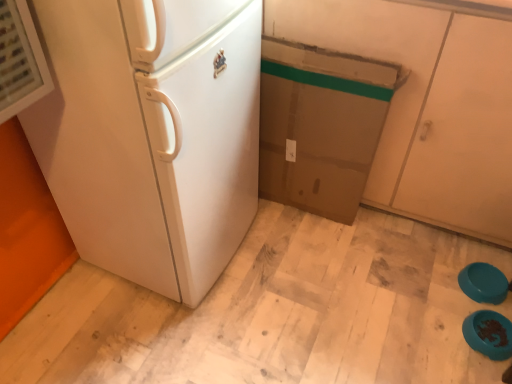
Question: Is teal plastic bowls at lower right, the 2th appliance viewed from the front, taller or shorter than teal glossy bowls at lower right, the 2th appliance in the back-to-front sequence?

Choices:
 (A) short
 (B) tall

Answer: (A)

Question: From a real-world perspective, relative to teal glossy bowls at lower right, marked as the 1th appliance in a front-to-back arrangement, is teal plastic bowls at lower right, which appears as the 1th appliance when viewed from the back, vertically above or below?

Choices:
 (A) above
 (B) below

Answer: (A)

Question: Which object is positioned closest to the white matte refrigerator at left?

Choices:
 (A) teal glossy bowls at lower right, marked as the 1th appliance in a front-to-back arrangement
 (B) matte brown cabinet at center
 (C) teal plastic bowls at lower right, the 2th appliance viewed from the front

Answer: (B)

Question: Estimate the real-world distances between objects in this image. Which object is closer to the teal glossy bowls at lower right, the 2th appliance in the back-to-front sequence?

Choices:
 (A) white matte refrigerator at left
 (B) teal plastic bowls at lower right, which appears as the 1th appliance when viewed from the back
 (C) matte brown cabinet at center

Answer: (B)